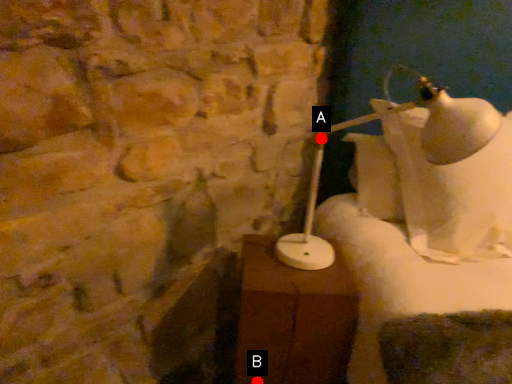
Question: Two points are circled on the image, labeled by A and B beside each circle. Which point is farther from the camera taking this photo?

Choices:
 (A) A is further
 (B) B is further

Answer: (B)